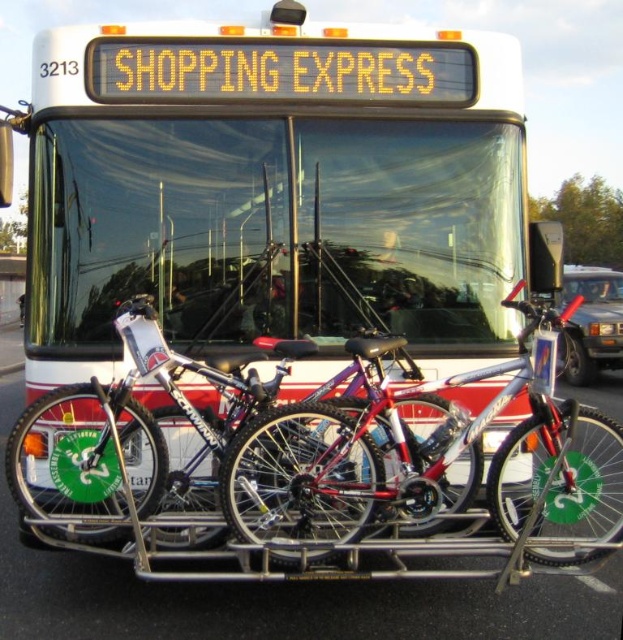
You are a delivery person standing next to the white matte bus at center and want to place a package on the shiny silver bicycle at center. Can you reach the bicycle without moving the bus? Explain why or why not.

The white matte bus at center is 18.87 inches away from the shiny silver bicycle at center. Since 18.87 inches is approximately 1.57 feet, which is a reasonable distance for a person to reach, you can likely place the package on the bicycle without needing to move the bus.